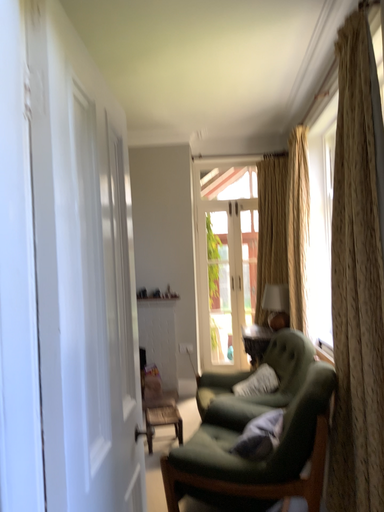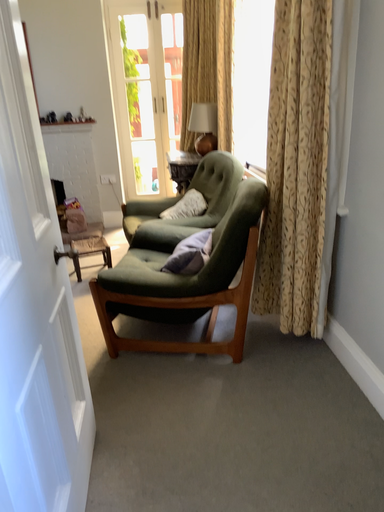
Question: Which way did the camera rotate in the video?

Choices:
 (A) rotated upward
 (B) rotated downward

Answer: (B)